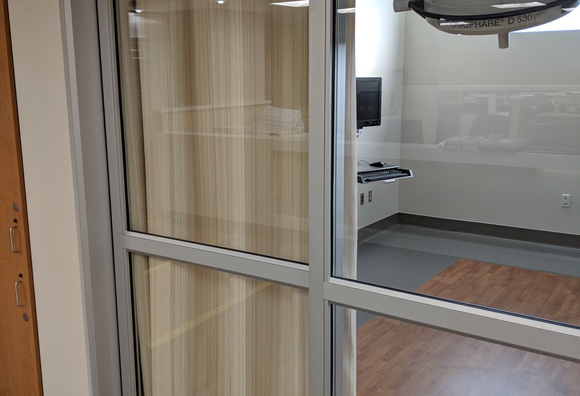
This screenshot has height=396, width=580. What are the coordinates of `reflection of long desk` in the screenshot? It's located at pyautogui.click(x=567, y=139), pyautogui.click(x=409, y=127), pyautogui.click(x=269, y=120), pyautogui.click(x=174, y=117).